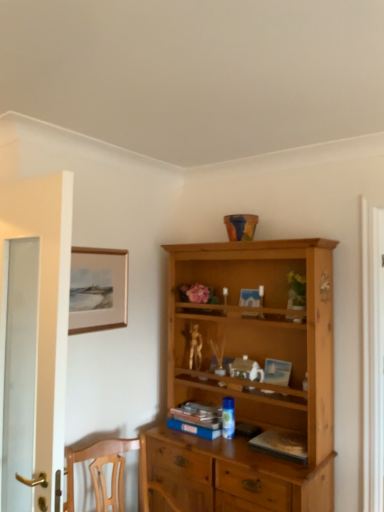
Question: Is hardcover book at center, the second book from the back, outside white glass door at left?

Choices:
 (A) no
 (B) yes

Answer: (B)

Question: Is hardcover book at center, the second book from the back, at the left side of white glass door at left?

Choices:
 (A) no
 (B) yes

Answer: (A)

Question: Can you confirm if hardcover book at center, which is the 2th book from left to right, is bigger than white glass door at left?

Choices:
 (A) no
 (B) yes

Answer: (A)

Question: Is hardcover book at center, acting as the first book starting from the right, far away from white glass door at left?

Choices:
 (A) no
 (B) yes

Answer: (B)

Question: Is hardcover book at center, acting as the first book starting from the right, positioned before white glass door at left?

Choices:
 (A) no
 (B) yes

Answer: (A)

Question: In terms of size, does gold metallic figurine at center appear bigger or smaller than hardcover book at center, acting as the first book starting from the right?

Choices:
 (A) big
 (B) small

Answer: (B)

Question: From a real-world perspective, is gold metallic figurine at center physically located above or below hardcover book at center, acting as the first book starting from the right?

Choices:
 (A) below
 (B) above

Answer: (B)

Question: Relative to hardcover book at center, the 1th book positioned from the front, is gold metallic figurine at center in front or behind?

Choices:
 (A) behind
 (B) front

Answer: (A)

Question: In terms of width, does gold metallic figurine at center look wider or thinner when compared to hardcover book at center, which is the 2th book from left to right?

Choices:
 (A) wide
 (B) thin

Answer: (B)

Question: From a real-world perspective, is gold metallic figurine at center physically located above or below matte gold picture frame at upper left?

Choices:
 (A) below
 (B) above

Answer: (A)

Question: Is point (188, 367) positioned closer to the camera than point (122, 256)?

Choices:
 (A) farther
 (B) closer

Answer: (A)

Question: Which is correct: gold metallic figurine at center is inside matte gold picture frame at upper left, or outside of it?

Choices:
 (A) inside
 (B) outside

Answer: (B)

Question: Considering the positions of gold metallic figurine at center and matte gold picture frame at upper left in the image, is gold metallic figurine at center taller or shorter than matte gold picture frame at upper left?

Choices:
 (A) short
 (B) tall

Answer: (A)

Question: In the image, is hardcover book at center, which is the 2th book from left to right, on the left side or the right side of gold metallic figurine at center?

Choices:
 (A) left
 (B) right

Answer: (B)

Question: Is hardcover book at center, which is the 2th book from left to right, bigger or smaller than gold metallic figurine at center?

Choices:
 (A) big
 (B) small

Answer: (A)